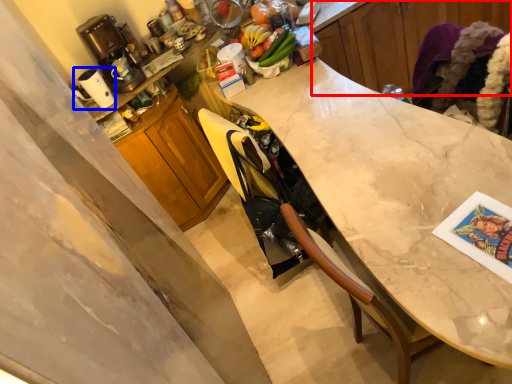
Question: Which object is closer to the camera taking this photo, cabinetry (highlighted by a red box) or appliance (highlighted by a blue box)?

Choices:
 (A) cabinetry
 (B) appliance

Answer: (B)